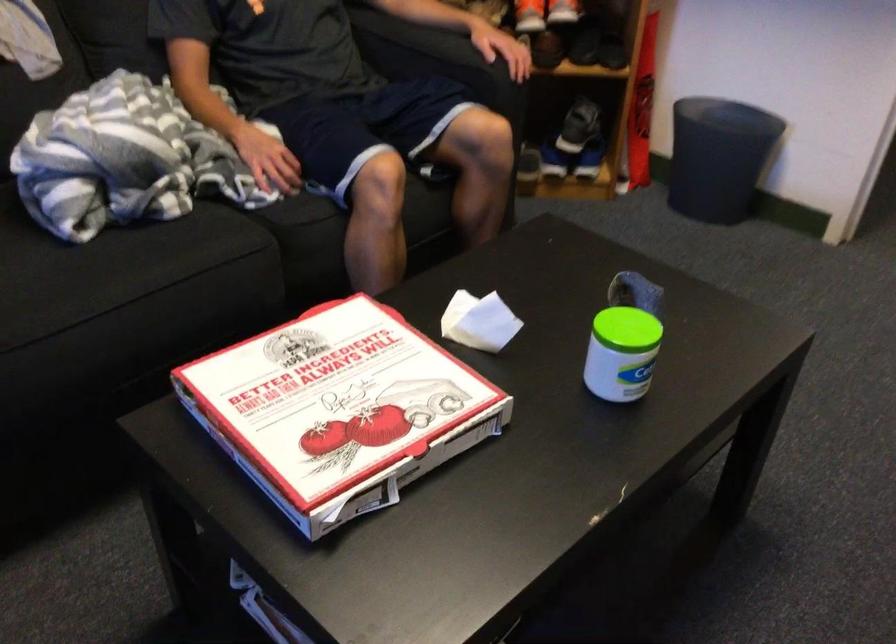
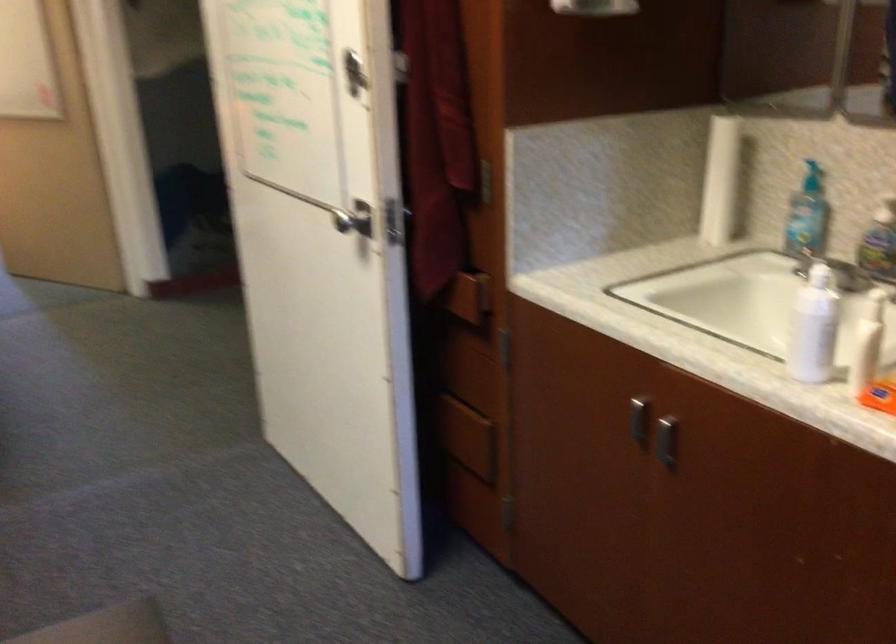
Question: The images are taken continuously from a first-person perspective. In which direction is your viewpoint rotating?

Choices:
 (A) Left
 (B) Right
 (C) Up
 (D) Down

Answer: (B)